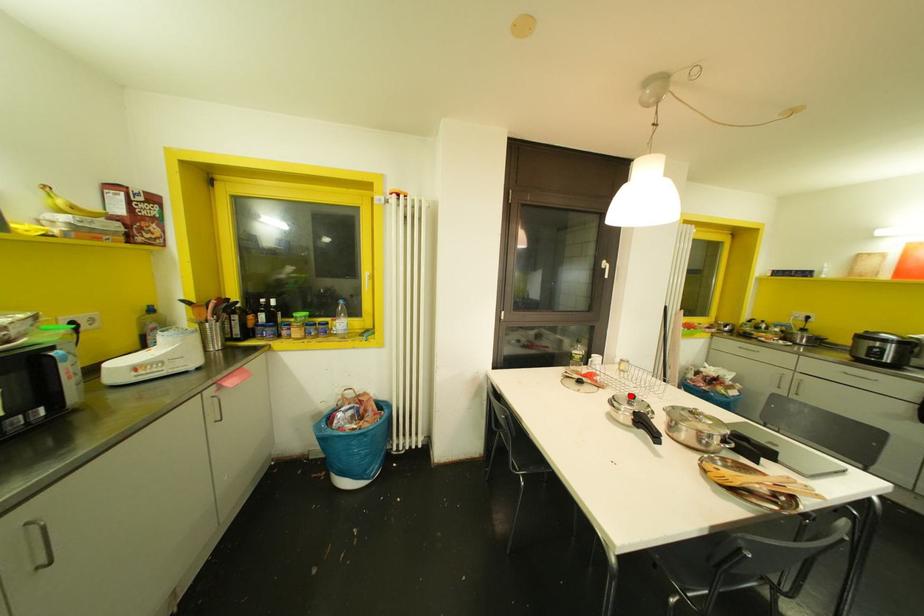
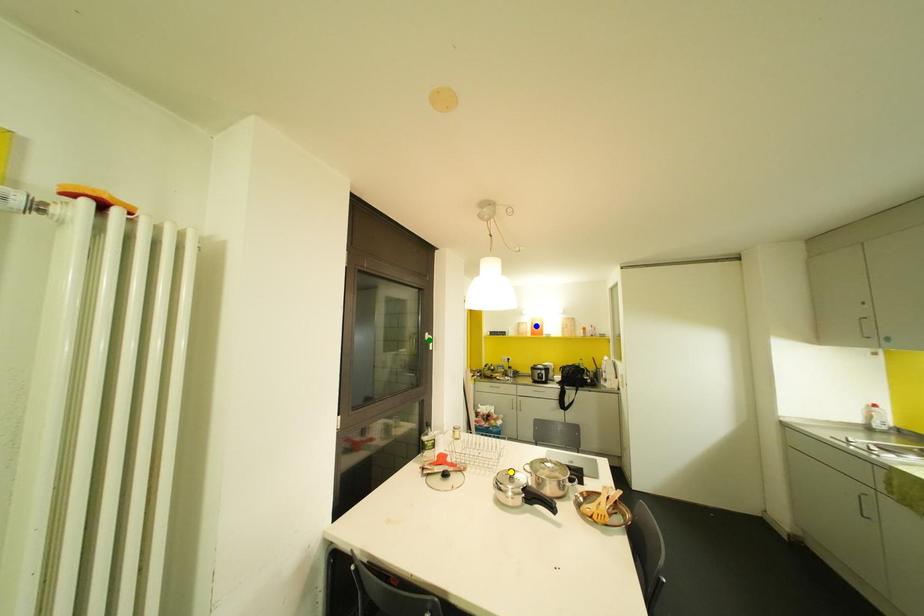
Question: I am providing you with two images of the same scene from different viewpoints. A red point is marked on the first image. You are given multiple points on the second image. Which point in image 2 is actually the same real-world point as the red point in image 1?

Choices:
 (A) green point
 (B) yellow point
 (C) blue point

Answer: (B)